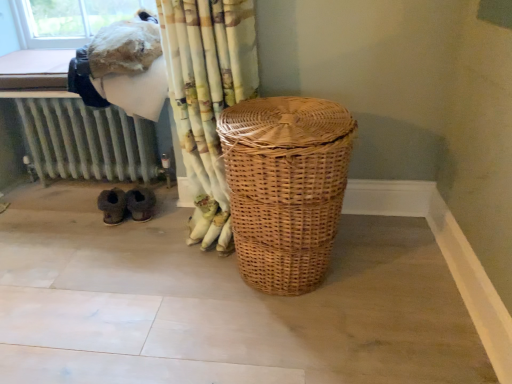
You are a GUI agent. You are given a task and a screenshot of the screen. Output one action in this format:
    pyautogui.click(x=<x>, y=<y>)
    Task: Click on the vacant area situated to the left side of patterned fabric curtain at center
    The width and height of the screenshot is (512, 384).
    Given the screenshot: What is the action you would take?
    pyautogui.click(x=124, y=252)